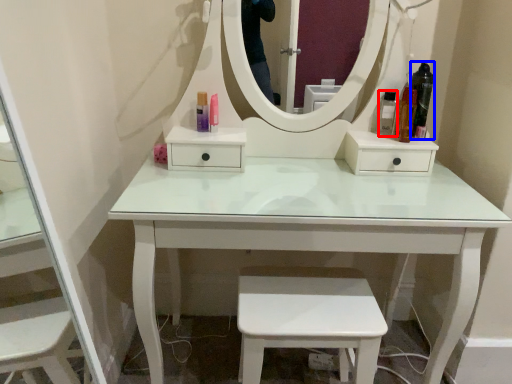
Question: Among these objects, which one is nearest to the camera, toiletry (highlighted by a red box) or toiletry (highlighted by a blue box)?

Choices:
 (A) toiletry
 (B) toiletry

Answer: (B)